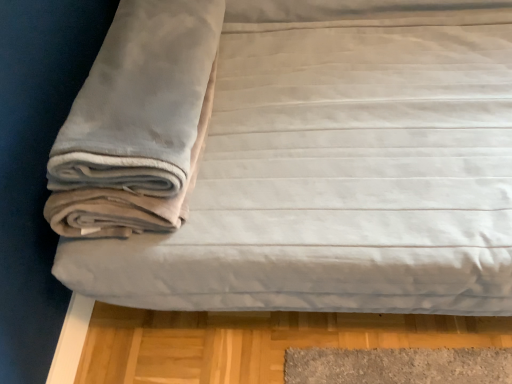
Image resolution: width=512 pixels, height=384 pixels. I want to click on beige velvety towels at left, so click(136, 122).

Image resolution: width=512 pixels, height=384 pixels. Describe the element at coordinates (136, 122) in the screenshot. I see `beige velvety towels at left` at that location.

Image resolution: width=512 pixels, height=384 pixels. In order to click on beige velvety towels at left in this screenshot , I will do `click(136, 122)`.